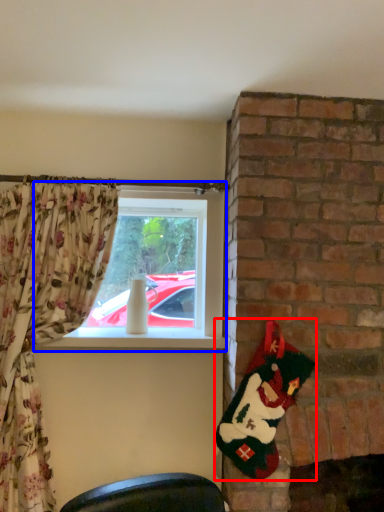
Question: Which object appears farthest to the camera in this image, santa claus (highlighted by a red box) or window (highlighted by a blue box)?

Choices:
 (A) santa claus
 (B) window

Answer: (B)